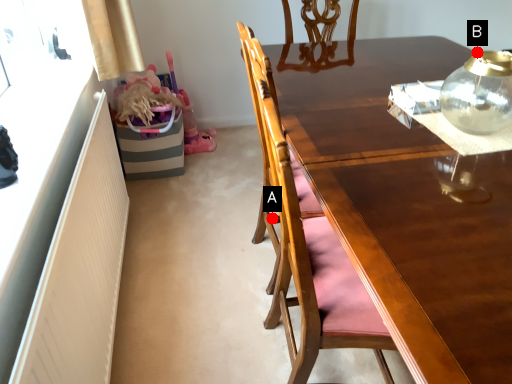
Question: Two points are circled on the image, labeled by A and B beside each circle. Which point appears closest to the camera in this image?

Choices:
 (A) A is closer
 (B) B is closer

Answer: (B)